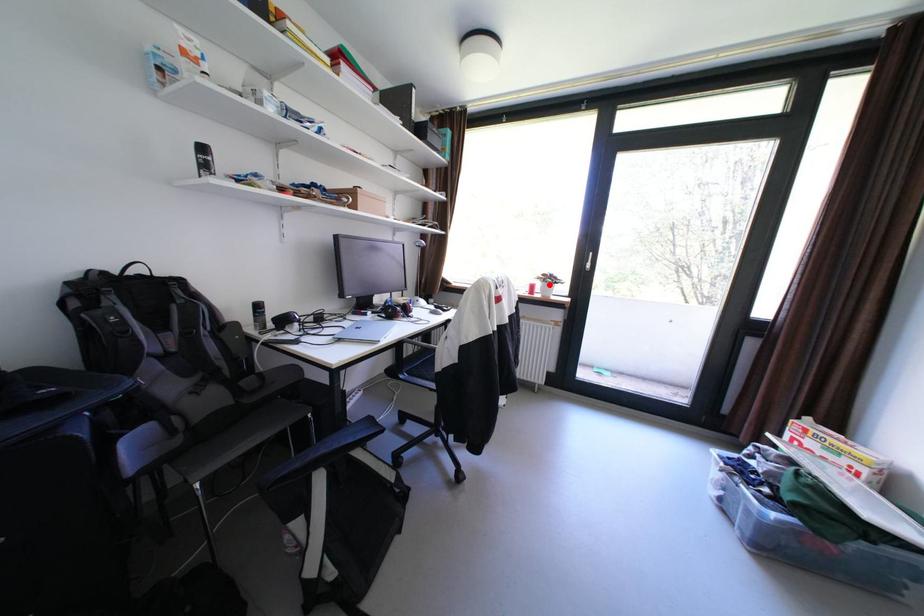
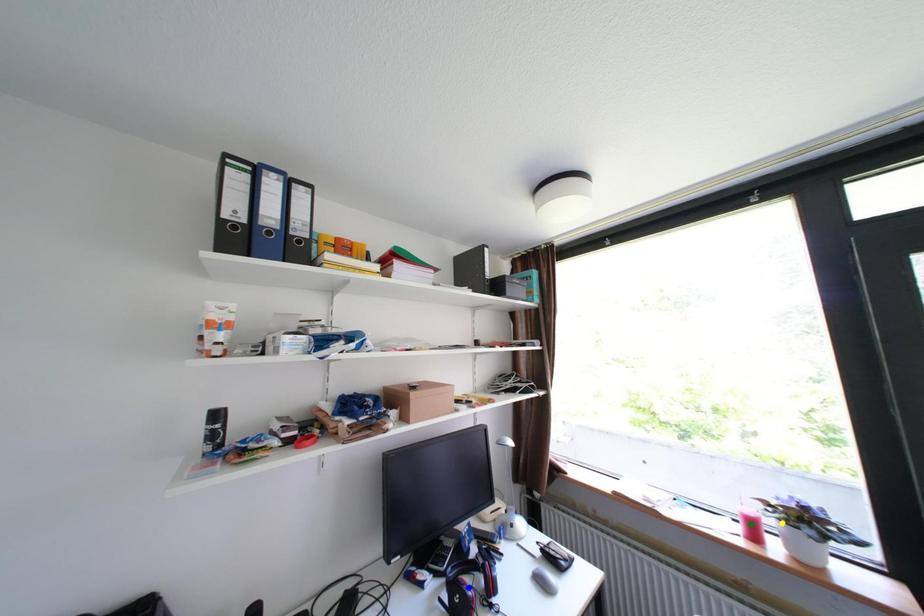
Question: I am providing you with two images of the same scene from different viewpoints. A red point is marked on the first image. You are given multiple points on the second image. Which mark in image 2 goes with the point in image 1?

Choices:
 (A) blue point
 (B) yellow point
 (C) green point

Answer: (B)